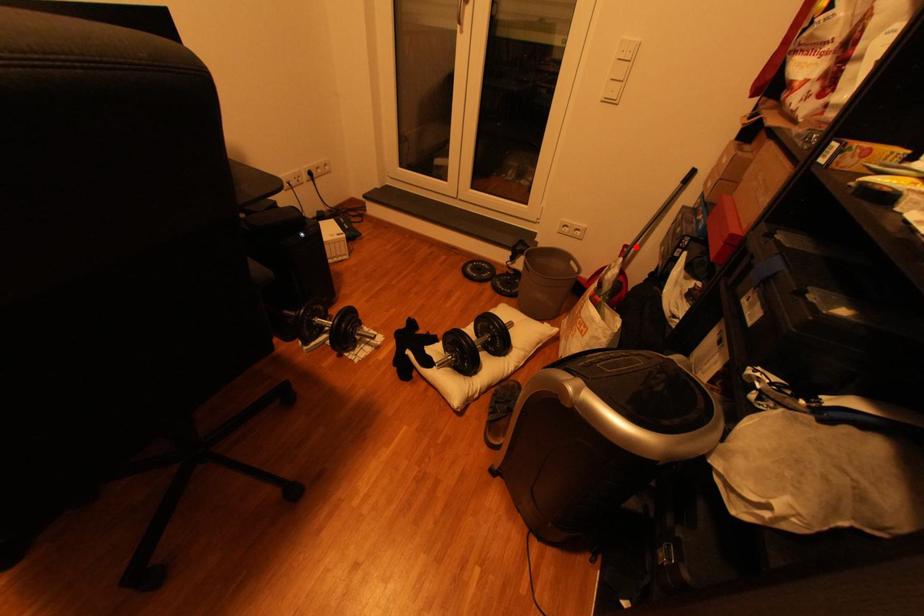
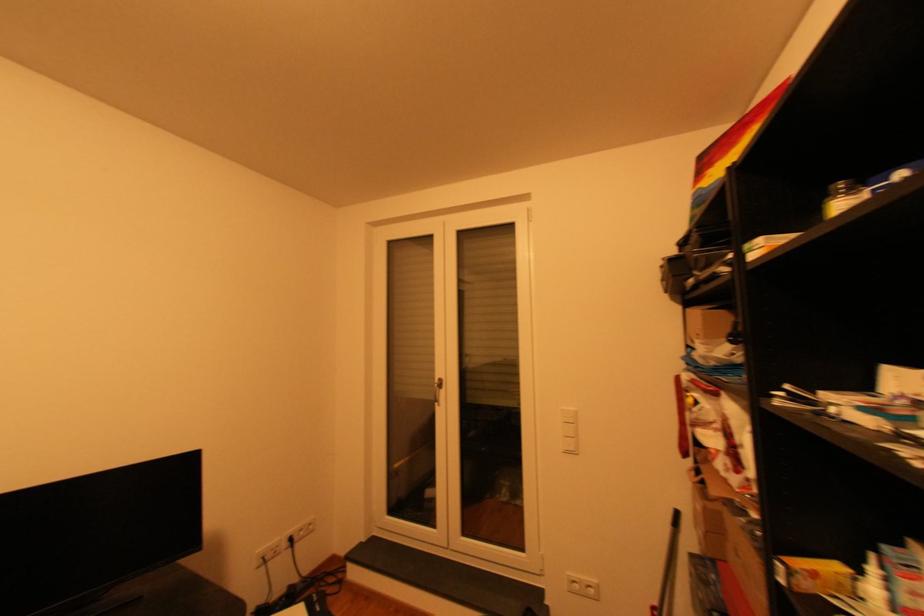
In the second image, find the point that corresponds to the highlighted location in the first image.

(662, 608)